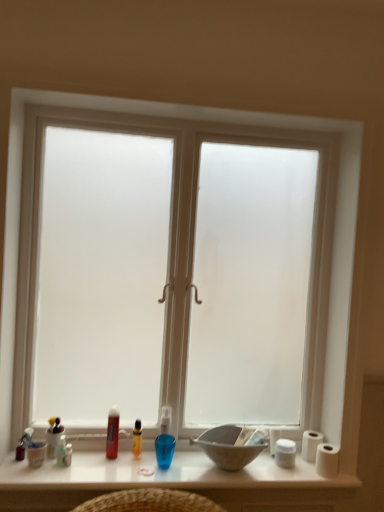
You are a GUI agent. You are given a task and a screenshot of the screen. Output one action in this format:
    pyautogui.click(x=<x>, y=<y>)
    Task: Click on the free point above white glossy table at lower center (from a real-world perspective)
    
    Given the screenshot: What is the action you would take?
    pyautogui.click(x=144, y=464)